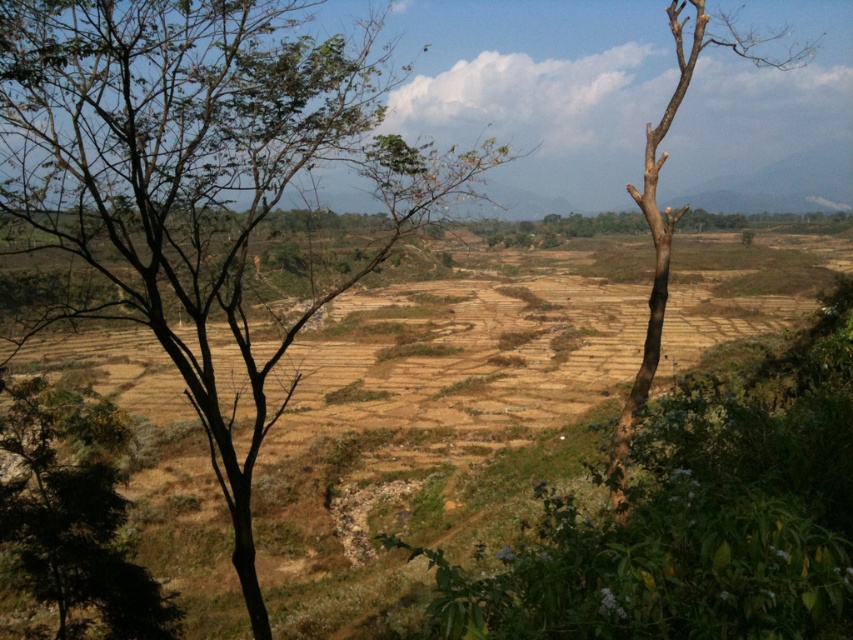
The height and width of the screenshot is (640, 853). What do you see at coordinates (202, 182) in the screenshot? I see `brown leafy tree at left` at bounding box center [202, 182].

Between point (364, 26) and point (634, 420), which one is positioned behind?

Point (364, 26)

Find the location of a particular element. brown leafy tree at left is located at coordinates [x=202, y=182].